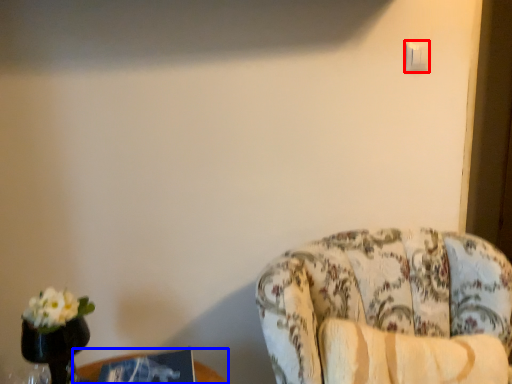
Question: Which object is further to the camera taking this photo, light switch (highlighted by a red box) or table (highlighted by a blue box)?

Choices:
 (A) light switch
 (B) table

Answer: (A)